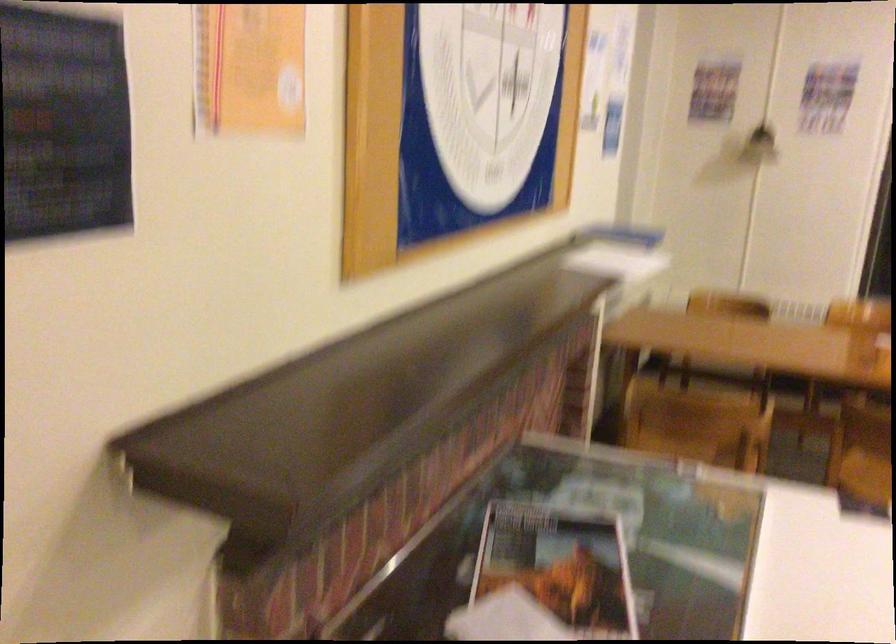
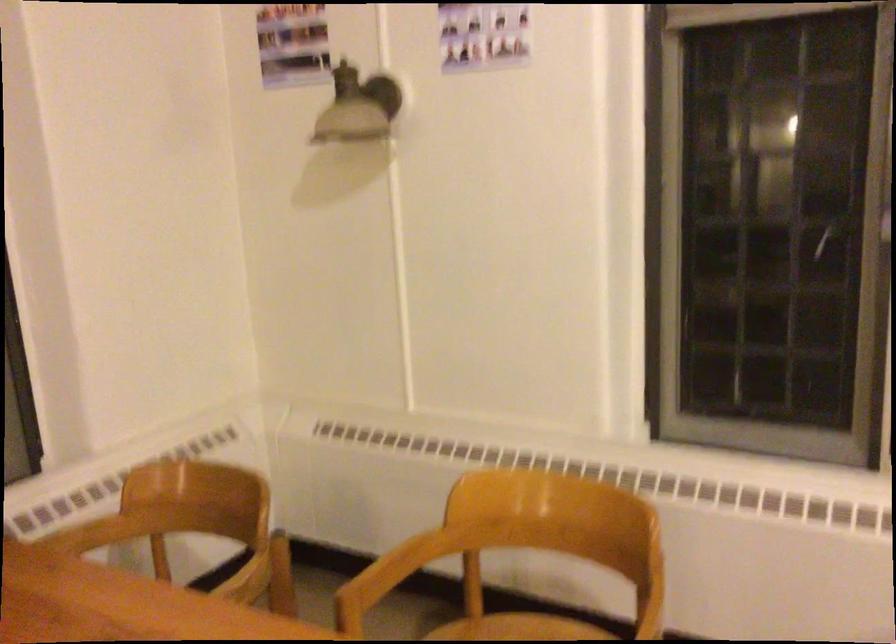
The point at (793,307) is marked in the first image. Where is the corresponding point in the second image?

(389, 574)